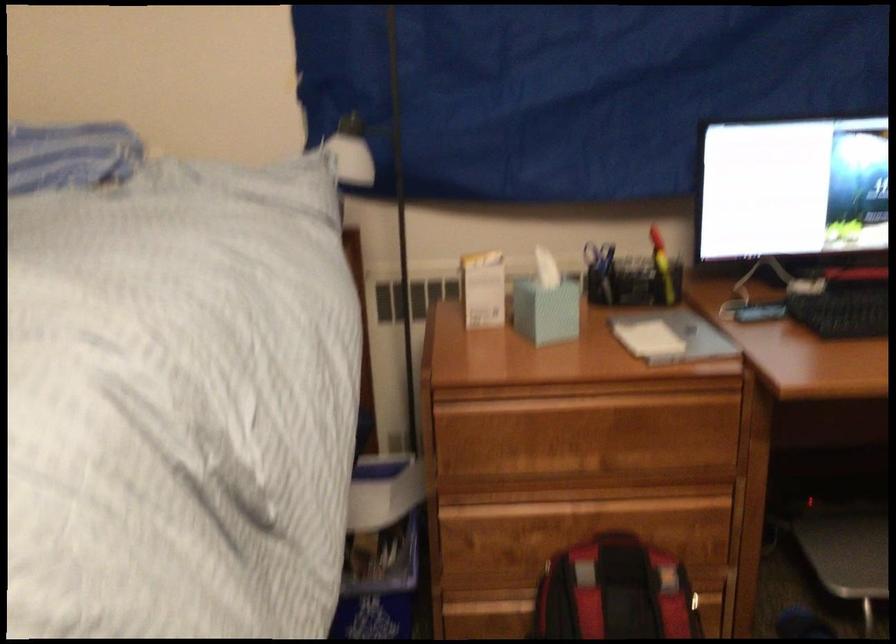
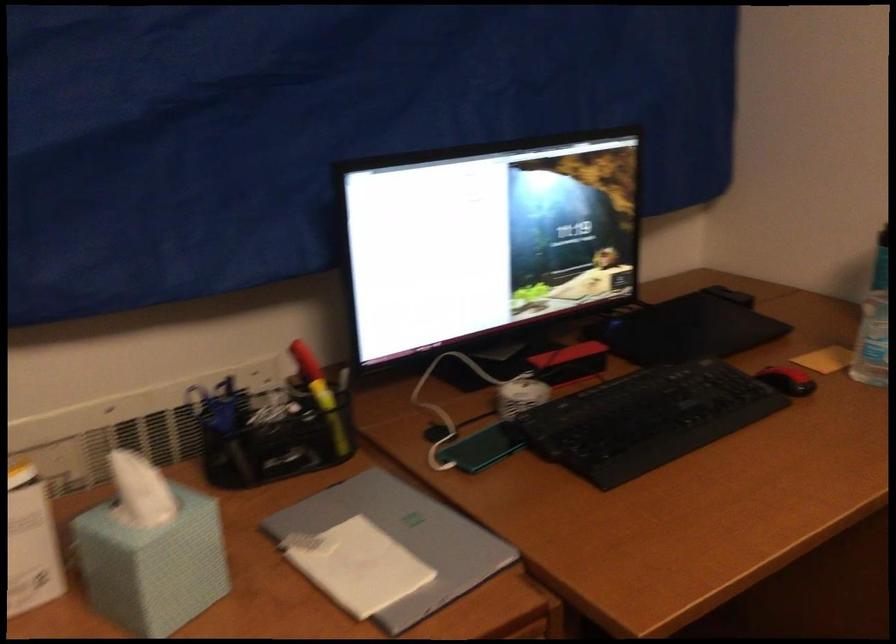
The point at (657, 263) is marked in the first image. Where is the corresponding point in the second image?

(321, 395)